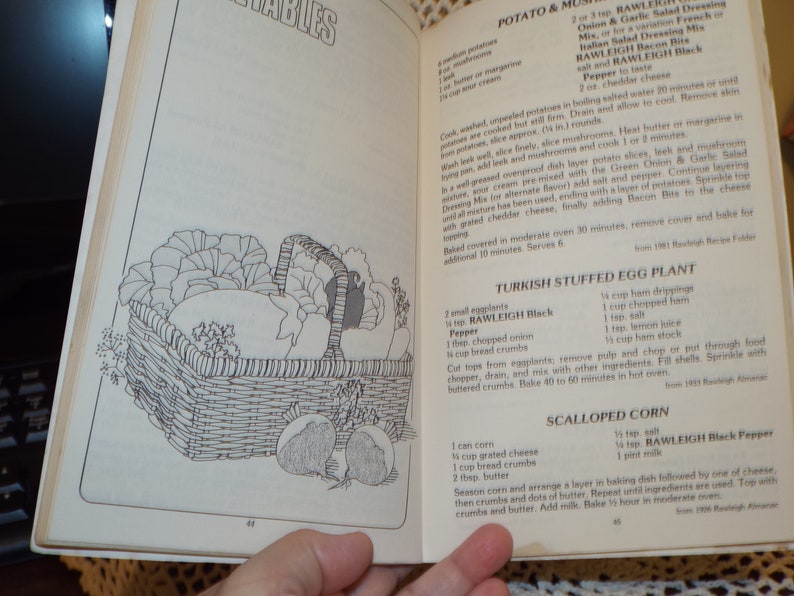
Locate an element on the screen. This screenshot has height=596, width=794. keyboard keys is located at coordinates (33, 426), (37, 403), (33, 377), (2, 392), (6, 412), (5, 431), (10, 471), (10, 502).